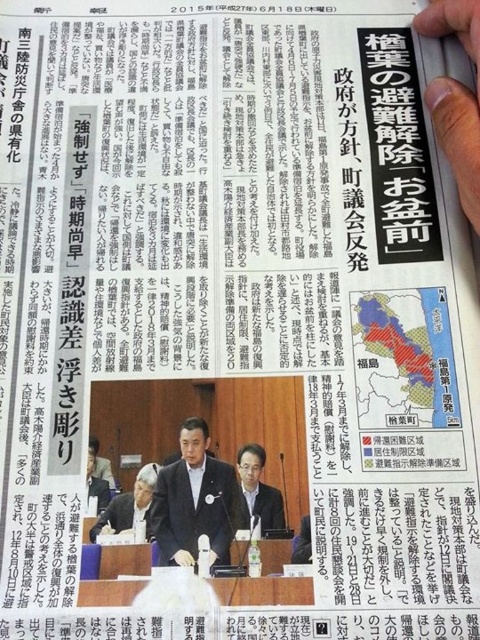
Which is more to the left, dark blue suit at center or white fabric jacket at center?

white fabric jacket at center is more to the left.

Does dark blue suit at center have a greater height compared to white fabric jacket at center?

Yes, dark blue suit at center is taller than white fabric jacket at center.

This screenshot has height=640, width=480. Find the location of `dark blue suit at center`. dark blue suit at center is located at coordinates (194, 500).

Does point (192, 448) lie in front of point (248, 472)?

No, (192, 448) is further to viewer.

Locate an element on the screen. dark blue suit at center is located at coordinates (194, 500).

The width and height of the screenshot is (480, 640). I want to click on dark blue suit at center, so click(x=194, y=500).

Consider the image. Does matte black suit at center have a lesser height compared to white fabric jacket at center?

No.

Consider the image. Between matte black suit at center and white fabric jacket at center, which one has more height?

Standing taller between the two is matte black suit at center.

Describe the element at coordinates (259, 490) in the screenshot. I see `matte black suit at center` at that location.

Where is `matte black suit at center`? Image resolution: width=480 pixels, height=640 pixels. matte black suit at center is located at coordinates (259, 490).